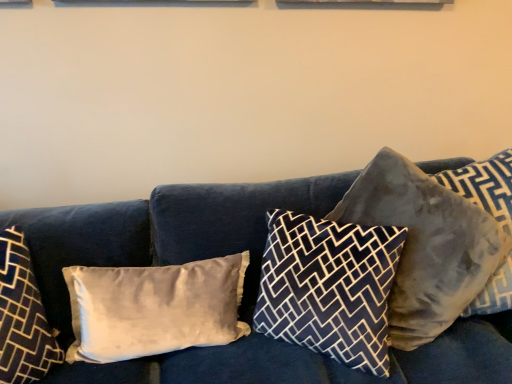
Question: Does velvet blue couch at center have a greater width compared to dark blue patterned pillow at center, which is the 3th pillow from right to left?

Choices:
 (A) no
 (B) yes

Answer: (B)

Question: Is velvet blue couch at center directly adjacent to dark blue patterned pillow at center, which is the 3th pillow in left-to-right order?

Choices:
 (A) no
 (B) yes

Answer: (A)

Question: Is velvet blue couch at center positioned far away from dark blue patterned pillow at center, which is the 3th pillow from right to left?

Choices:
 (A) no
 (B) yes

Answer: (A)

Question: Is velvet blue couch at center to the left of dark blue patterned pillow at center, which is the 3th pillow from right to left, from the viewer's perspective?

Choices:
 (A) yes
 (B) no

Answer: (A)

Question: Does velvet blue couch at center have a lesser height compared to dark blue patterned pillow at center, which is the 3th pillow from right to left?

Choices:
 (A) yes
 (B) no

Answer: (B)

Question: Can we say velvet blue couch at center lies outside dark blue patterned pillow at center, which is the 3th pillow from right to left?

Choices:
 (A) no
 (B) yes

Answer: (B)

Question: Is satin beige pillow at left, which appears as the 4th pillow when viewed from the right, turned away from velvety gray pillow at right, acting as the first pillow starting from the right?

Choices:
 (A) yes
 (B) no

Answer: (B)

Question: From a real-world perspective, is satin beige pillow at left, which is the 2th pillow from left to right, on velvety gray pillow at right, acting as the first pillow starting from the right?

Choices:
 (A) no
 (B) yes

Answer: (A)

Question: Can you confirm if satin beige pillow at left, which is the 2th pillow from left to right, is bigger than velvety gray pillow at right, the fifth pillow from the left?

Choices:
 (A) yes
 (B) no

Answer: (B)

Question: From a real-world perspective, does satin beige pillow at left, which is the 2th pillow from left to right, sit lower than velvety gray pillow at right, the fifth pillow from the left?

Choices:
 (A) no
 (B) yes

Answer: (B)

Question: Does satin beige pillow at left, which is the 2th pillow from left to right, have a lesser height compared to velvety gray pillow at right, acting as the first pillow starting from the right?

Choices:
 (A) no
 (B) yes

Answer: (B)

Question: Would you say satin beige pillow at left, which appears as the 4th pillow when viewed from the right, is outside velvety gray pillow at right, the fifth pillow from the left?

Choices:
 (A) yes
 (B) no

Answer: (A)

Question: Is satin beige pillow at left, which is the 2th pillow from left to right, looking in the opposite direction of dark blue patterned pillow at center, which is the 3th pillow in left-to-right order?

Choices:
 (A) yes
 (B) no

Answer: (B)